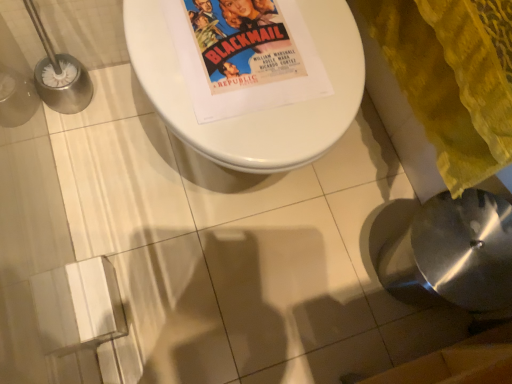
The width and height of the screenshot is (512, 384). I want to click on free point above white glossy toilet at center (from a real-world perspective), so click(x=254, y=56).